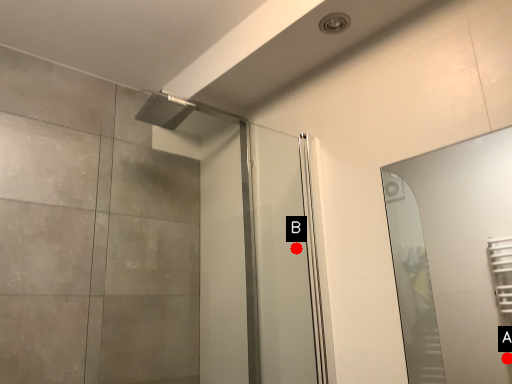
Question: Two points are circled on the image, labeled by A and B beside each circle. Which of the following is the closest to the observer?

Choices:
 (A) A is closer
 (B) B is closer

Answer: (B)